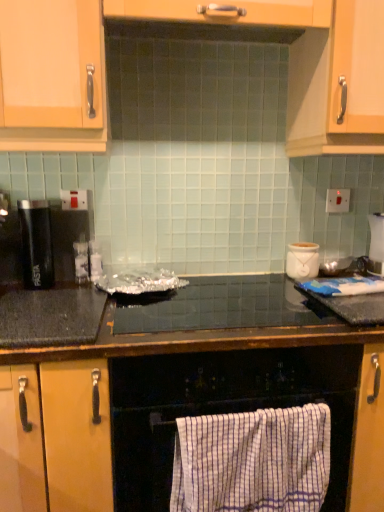
Question: From a real-world perspective, is black granite countertop at center, positioned as the 2th countertop in top-to-bottom order, on black matte pasta container at left?

Choices:
 (A) no
 (B) yes

Answer: (A)

Question: From the image's perspective, does black granite countertop at center, which ranks as the 1th countertop in bottom-to-top order, appear higher than black matte pasta container at left?

Choices:
 (A) yes
 (B) no

Answer: (B)

Question: Is black matte pasta container at left inside black granite countertop at center, which ranks as the 1th countertop in bottom-to-top order?

Choices:
 (A) yes
 (B) no

Answer: (B)

Question: Is the depth of black granite countertop at center, which ranks as the 1th countertop in bottom-to-top order, greater than that of black matte pasta container at left?

Choices:
 (A) yes
 (B) no

Answer: (B)

Question: Is black matte pasta container at left at the back of black granite countertop at center, positioned as the 2th countertop in top-to-bottom order?

Choices:
 (A) no
 (B) yes

Answer: (A)

Question: Looking at their shapes, would you say black matte pasta container at left is wider or thinner than black glossy countertop at center, arranged as the second countertop when ordered from the bottom?

Choices:
 (A) thin
 (B) wide

Answer: (A)

Question: Is point (39, 223) positioned closer to the camera than point (281, 276)?

Choices:
 (A) farther
 (B) closer

Answer: (B)

Question: Is black matte pasta container at left to the left or to the right of black glossy countertop at center, arranged as the second countertop when ordered from the bottom, in the image?

Choices:
 (A) left
 (B) right

Answer: (A)

Question: Is black matte pasta container at left taller or shorter than black glossy countertop at center, arranged as the second countertop when ordered from the bottom?

Choices:
 (A) tall
 (B) short

Answer: (A)

Question: Looking at their shapes, would you say black granite countertop at center, positioned as the 2th countertop in top-to-bottom order, is wider or thinner than black matte pasta container at left?

Choices:
 (A) thin
 (B) wide

Answer: (B)

Question: From the image's perspective, is black granite countertop at center, which ranks as the 1th countertop in bottom-to-top order, located above or below black matte pasta container at left?

Choices:
 (A) below
 (B) above

Answer: (A)

Question: From a real-world perspective, is black granite countertop at center, positioned as the 2th countertop in top-to-bottom order, above or below black matte pasta container at left?

Choices:
 (A) below
 (B) above

Answer: (A)

Question: Is point (24, 480) positioned closer to the camera than point (36, 224)?

Choices:
 (A) farther
 (B) closer

Answer: (B)

Question: From a real-world perspective, is white checkered towel at lower center positioned above or below white striped towel at lower center?

Choices:
 (A) below
 (B) above

Answer: (A)

Question: In terms of height, does white checkered towel at lower center look taller or shorter compared to white striped towel at lower center?

Choices:
 (A) short
 (B) tall

Answer: (B)